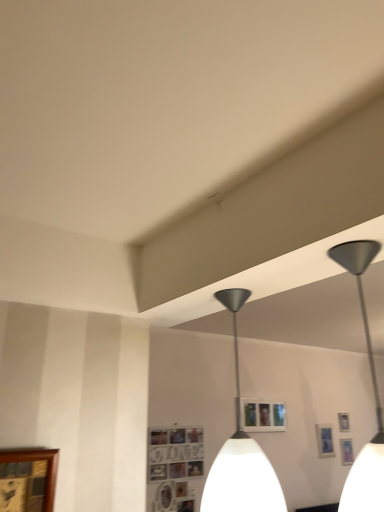
Measure the distance between wooden photo frame at lower center, the second picture frame positioned from the left, and camera.

wooden photo frame at lower center, the second picture frame positioned from the left, and camera are 2.84 meters apart from each other.

At what (x,y) coordinates should I click in order to perform the action: click on metallic gray pendant light at center. Please return your answer as a coordinate pair (x, y). Looking at the image, I should click on (241, 453).

Is there a large distance between metallic silver picture frame at upper right, the 1th picture frame in the right-to-left sequence, and wooden photo frame at lower center, which is counted as the second picture frame, starting from the top?

Yes, metallic silver picture frame at upper right, the 1th picture frame in the right-to-left sequence, and wooden photo frame at lower center, which is counted as the second picture frame, starting from the top, are located far from each other.

Based on their positions, is metallic silver picture frame at upper right, arranged as the 4th picture frame when viewed from the top, located to the left or right of wooden photo frame at lower center, the second picture frame in the front-to-back sequence?

Clearly, metallic silver picture frame at upper right, arranged as the 4th picture frame when viewed from the top, is on the right of wooden photo frame at lower center, the second picture frame in the front-to-back sequence, in the image.

Is metallic silver picture frame at upper right, arranged as the third picture frame when viewed from the front, oriented away from wooden photo frame at lower center, which ranks as the 3th picture frame in right-to-left order?

No.

How many degrees apart are the facing directions of metallic silver picture frame at upper right, the fourth picture frame from the front, and wooden picture frame at lower left, the 1th picture frame viewed from the left?

0.558 degrees separate the facing orientations of metallic silver picture frame at upper right, the fourth picture frame from the front, and wooden picture frame at lower left, the 1th picture frame viewed from the left.

Find the location of a particular element. the 1st picture frame positioned below the metallic silver picture frame at upper right, the first picture frame viewed from the back (from a real-world perspective) is located at coordinates (28, 479).

Would you say metallic silver picture frame at upper right, the 3th picture frame positioned from the top, is outside wooden picture frame at lower left, positioned as the 1th picture frame in front-to-back order?

Indeed, metallic silver picture frame at upper right, the 3th picture frame positioned from the top, is completely outside wooden picture frame at lower left, positioned as the 1th picture frame in front-to-back order.

In terms of size, does metallic silver picture frame at upper right, the 3th picture frame positioned from the top, appear bigger or smaller than wooden picture frame at lower left, marked as the 4th picture frame in a right-to-left arrangement?

Considering their sizes, metallic silver picture frame at upper right, the 3th picture frame positioned from the top, takes up less space than wooden picture frame at lower left, marked as the 4th picture frame in a right-to-left arrangement.

Does metallic gray pendant light at center have a greater height compared to wooden photo frame at lower center, the third picture frame from the bottom?

Yes.

From a real-world perspective, is metallic gray pendant light at center above or below wooden photo frame at lower center, which is the 3th picture frame in back-to-front order?

Clearly, from a real-world perspective, metallic gray pendant light at center is above wooden photo frame at lower center, which is the 3th picture frame in back-to-front order.

Is metallic gray pendant light at center bigger or smaller than wooden photo frame at lower center, the second picture frame positioned from the left?

Considering their sizes, metallic gray pendant light at center takes up more space than wooden photo frame at lower center, the second picture frame positioned from the left.

Between metallic gray pendant light at center and wooden photo frame at lower center, which is the 3th picture frame in back-to-front order, which one is positioned behind?

wooden photo frame at lower center, which is the 3th picture frame in back-to-front order.

Is metallic gray pendant light at center far away from wooden picture frame at lower left, the 1th picture frame viewed from the left?

metallic gray pendant light at center is positioned a significant distance from wooden picture frame at lower left, the 1th picture frame viewed from the left.

Who is bigger, metallic gray pendant light at center or wooden picture frame at lower left, positioned as the 1th picture frame in front-to-back order?

metallic gray pendant light at center.

Who is shorter, metallic gray pendant light at center or wooden picture frame at lower left, the 1th picture frame viewed from the left?

Standing shorter between the two is wooden picture frame at lower left, the 1th picture frame viewed from the left.

Which is behind, metallic gray pendant light at center or wooden picture frame at lower left, positioned as the 1th picture frame in top-to-bottom order?

wooden picture frame at lower left, positioned as the 1th picture frame in top-to-bottom order, is behind.

Is there a large distance between wooden picture frame at lower left, positioned as the 1th picture frame in top-to-bottom order, and metallic silver picture frame at upper right, the fourth picture frame viewed from the left?

Yes, wooden picture frame at lower left, positioned as the 1th picture frame in top-to-bottom order, and metallic silver picture frame at upper right, the fourth picture frame viewed from the left, are quite far apart.

The height and width of the screenshot is (512, 384). In order to click on picture frame that is the 2nd one below the wooden picture frame at lower left, the 1th picture frame viewed from the left (from a real-world perspective) in this screenshot , I will do [346, 452].

From a real-world perspective, is wooden picture frame at lower left, marked as the 4th picture frame in a bottom-to-top arrangement, above or below metallic silver picture frame at upper right, the 1th picture frame in the right-to-left sequence?

wooden picture frame at lower left, marked as the 4th picture frame in a bottom-to-top arrangement, is above metallic silver picture frame at upper right, the 1th picture frame in the right-to-left sequence.

Considering the sizes of wooden picture frame at lower left, which appears as the fourth picture frame when viewed from the back, and metallic silver picture frame at upper right, the 1th picture frame in the right-to-left sequence, in the image, is wooden picture frame at lower left, which appears as the fourth picture frame when viewed from the back, wider or thinner than metallic silver picture frame at upper right, the 1th picture frame in the right-to-left sequence,?

Considering their sizes, wooden picture frame at lower left, which appears as the fourth picture frame when viewed from the back, looks broader than metallic silver picture frame at upper right, the 1th picture frame in the right-to-left sequence.

From the image's perspective, is wooden photo frame at lower center, the third picture frame from the bottom, under metallic silver picture frame at upper right, the 1th picture frame in the right-to-left sequence?

Incorrect, from the image's perspective, wooden photo frame at lower center, the third picture frame from the bottom, is higher than metallic silver picture frame at upper right, the 1th picture frame in the right-to-left sequence.

Locate an element on the screen. the 1st picture frame above the metallic silver picture frame at upper right, the first picture frame when ordered from bottom to top (from a real-world perspective) is located at coordinates (175, 453).

Which is behind, point (184, 456) or point (348, 442)?

Point (348, 442)

Is wooden photo frame at lower center, the second picture frame in the front-to-back sequence, placed right next to metallic silver picture frame at upper right, the first picture frame when ordered from bottom to top?

No, wooden photo frame at lower center, the second picture frame in the front-to-back sequence, is not making contact with metallic silver picture frame at upper right, the first picture frame when ordered from bottom to top.

Is metallic silver picture frame at upper right, the 1th picture frame in the right-to-left sequence, looking in the opposite direction of wooden picture frame at lower left, marked as the 4th picture frame in a bottom-to-top arrangement?

No, metallic silver picture frame at upper right, the 1th picture frame in the right-to-left sequence,'s orientation is not away from wooden picture frame at lower left, marked as the 4th picture frame in a bottom-to-top arrangement.

Which is more distant, (346, 447) or (27, 468)?

The point (346, 447) is farther.

From a real-world perspective, does metallic silver picture frame at upper right, the 1th picture frame in the right-to-left sequence, stand above wooden picture frame at lower left, positioned as the 1th picture frame in front-to-back order?

No, from a real-world perspective, metallic silver picture frame at upper right, the 1th picture frame in the right-to-left sequence, is not over wooden picture frame at lower left, positioned as the 1th picture frame in front-to-back order

Find the location of a particular element. picture frame below the wooden photo frame at lower center, which is the 3th picture frame in back-to-front order (from a real-world perspective) is located at coordinates (346, 452).

There is a wooden picture frame at lower left, which appears as the fourth picture frame when viewed from the back. Where is `the 2nd picture frame below it (from the image's perspective)`? Image resolution: width=384 pixels, height=512 pixels. the 2nd picture frame below it (from the image's perspective) is located at coordinates (344, 422).

When comparing their distances from wooden picture frame at lower left, positioned as the 1th picture frame in top-to-bottom order, does metallic gray pendant light at center or metallic silver picture frame at upper right, marked as the 2th picture frame in a back-to-front arrangement, seem closer?

Among the two, metallic gray pendant light at center is located nearer to wooden picture frame at lower left, positioned as the 1th picture frame in top-to-bottom order.

From the image, which object appears to be farther from metallic silver picture frame at upper right, arranged as the 2th picture frame when viewed from the right, metallic gray pendant light at center or metallic silver picture frame at upper right, arranged as the third picture frame when viewed from the front?

metallic gray pendant light at center is positioned further to the anchor metallic silver picture frame at upper right, arranged as the 2th picture frame when viewed from the right.

Based on their spatial positions, is metallic silver picture frame at upper right, the first picture frame when ordered from bottom to top, or metallic gray pendant light at center further from metallic silver picture frame at upper right, the fourth picture frame from the front?

metallic gray pendant light at center lies further to metallic silver picture frame at upper right, the fourth picture frame from the front, than the other object.

Considering their positions, is metallic silver picture frame at upper right, the fourth picture frame viewed from the left, positioned closer to metallic gray pendant light at center than wooden picture frame at lower left, the 1th picture frame viewed from the left?

metallic silver picture frame at upper right, the fourth picture frame viewed from the left, lies closer to metallic gray pendant light at center than the other object.

From the picture: From the image, which object appears to be farther from metallic gray pendant light at center, wooden photo frame at lower center, the second picture frame positioned from the left, or wooden picture frame at lower left, positioned as the 1th picture frame in front-to-back order?

Among the two, wooden picture frame at lower left, positioned as the 1th picture frame in front-to-back order, is located further to metallic gray pendant light at center.

Estimate the real-world distances between objects in this image. Which object is further from wooden picture frame at lower left, positioned as the 1th picture frame in front-to-back order, metallic silver picture frame at upper right, the fourth picture frame from the front, or metallic gray pendant light at center?

Based on the image, metallic silver picture frame at upper right, the fourth picture frame from the front, appears to be further to wooden picture frame at lower left, positioned as the 1th picture frame in front-to-back order.

Considering their positions, is metallic silver picture frame at upper right, arranged as the third picture frame when viewed from the front, positioned closer to metallic gray pendant light at center than wooden photo frame at lower center, which is the 3th picture frame in back-to-front order?

wooden photo frame at lower center, which is the 3th picture frame in back-to-front order, is closer to metallic gray pendant light at center.

When comparing their distances from metallic silver picture frame at upper right, the fourth picture frame viewed from the left, does metallic gray pendant light at center or metallic silver picture frame at upper right, which is the third picture frame from left to right, seem closer?

The object closer to metallic silver picture frame at upper right, the fourth picture frame viewed from the left, is metallic silver picture frame at upper right, which is the third picture frame from left to right.

The height and width of the screenshot is (512, 384). I want to click on picture frame between metallic gray pendant light at center and wooden photo frame at lower center, the third picture frame from the bottom, along the z-axis, so click(x=28, y=479).

Locate an element on the screen. picture frame situated between wooden photo frame at lower center, the third picture frame from the bottom, and metallic silver picture frame at upper right, arranged as the third picture frame when viewed from the front, from left to right is located at coordinates (344, 422).

Identify the location of picture frame located between wooden picture frame at lower left, positioned as the 1th picture frame in front-to-back order, and metallic silver picture frame at upper right, the first picture frame when ordered from bottom to top, in the depth direction. The height and width of the screenshot is (512, 384). (175, 453).